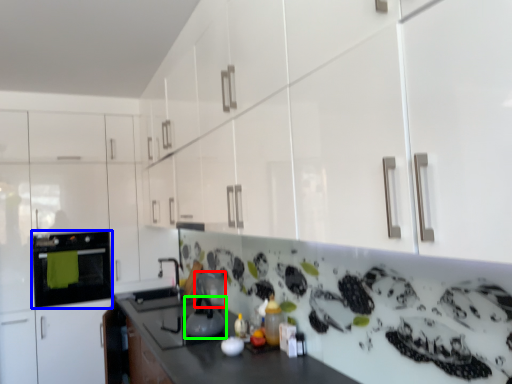
Question: Which is farther away from appliance (highlighted by a red box)? home appliance (highlighted by a blue box) or kitchen appliance (highlighted by a green box)?

Choices:
 (A) home appliance
 (B) kitchen appliance

Answer: (A)